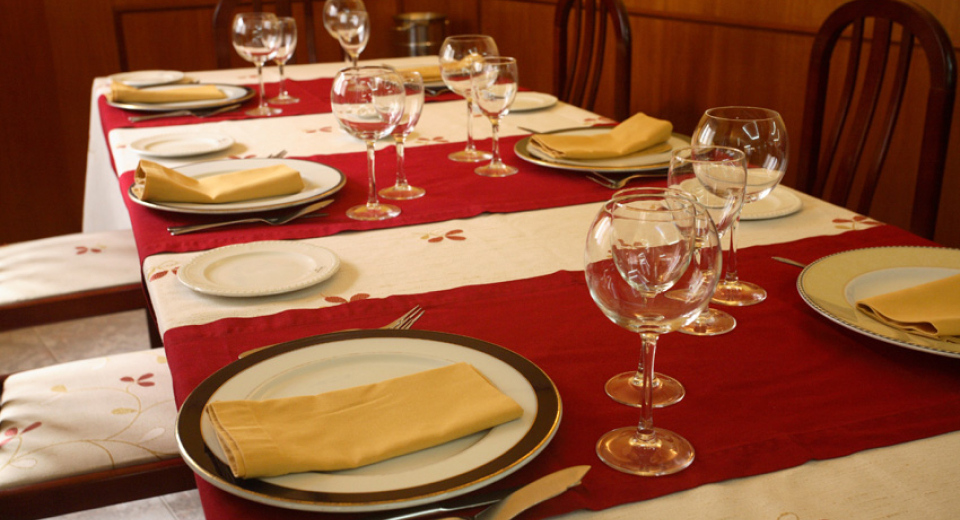
The width and height of the screenshot is (960, 520). I want to click on napkins, so click(x=321, y=428), click(x=942, y=308), click(x=228, y=187), click(x=652, y=131), click(x=163, y=87), click(x=438, y=72).